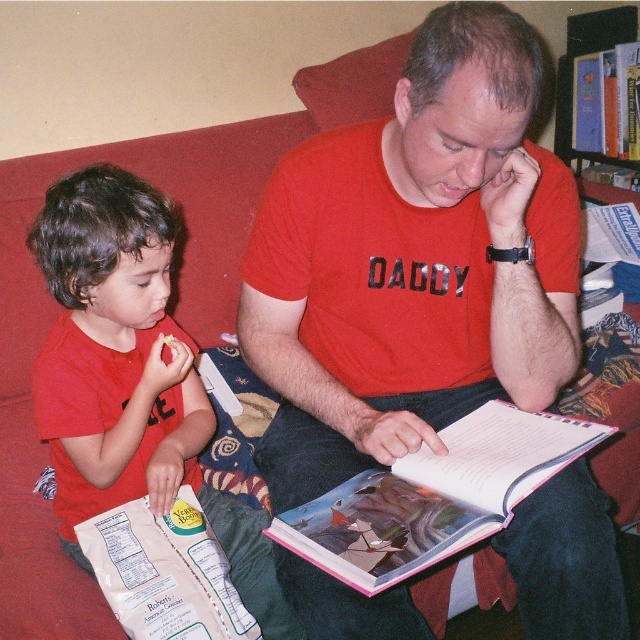
You are a librarian who wants to return the hardcover book at upper right to its original place on the wooden bookshelf at upper right. Can you do this without moving anything else?

The hardcover book at upper right is in front of the wooden bookshelf at upper right, so you can move it back to its original place without needing to move other items.

You are a librarian who needs to return the pink paper book at center to its proper place on the wooden bookshelf at upper right. The bookshelf has a height of 6 feet. Can you reach the shelf without needing a ladder?

The pink paper book at center is 5.71 feet away from the wooden bookshelf at upper right. Since the bookshelf is 6 feet tall, the distance between them is less than the bookshelf height. Therefore, you can reach the shelf without needing a ladder.